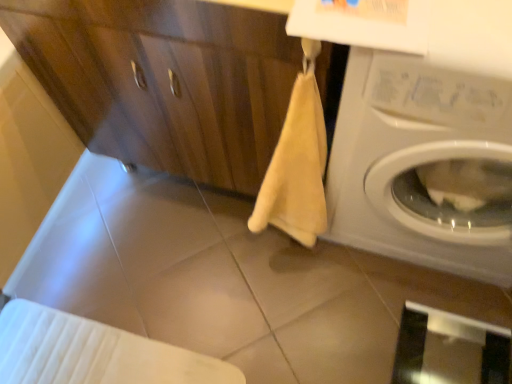
Question: Is beige matte tile at center to the left of transparent glass screen door at lower right from the viewer's perspective?

Choices:
 (A) no
 (B) yes

Answer: (B)

Question: Does beige matte tile at center come in front of transparent glass screen door at lower right?

Choices:
 (A) yes
 (B) no

Answer: (B)

Question: Can you see beige matte tile at center touching transparent glass screen door at lower right?

Choices:
 (A) no
 (B) yes

Answer: (A)

Question: From the image's perspective, would you say beige matte tile at center is positioned over transparent glass screen door at lower right?

Choices:
 (A) yes
 (B) no

Answer: (A)

Question: Can you confirm if beige matte tile at center is smaller than transparent glass screen door at lower right?

Choices:
 (A) yes
 (B) no

Answer: (B)

Question: Is beige matte tile at center further to the viewer compared to transparent glass screen door at lower right?

Choices:
 (A) no
 (B) yes

Answer: (B)

Question: Can you confirm if beige matte tile at center is taller than white glossy washing machine at right?

Choices:
 (A) no
 (B) yes

Answer: (A)

Question: Is beige matte tile at center looking in the opposite direction of white glossy washing machine at right?

Choices:
 (A) yes
 (B) no

Answer: (B)

Question: Is beige matte tile at center closer to the viewer compared to white glossy washing machine at right?

Choices:
 (A) yes
 (B) no

Answer: (B)

Question: Is beige matte tile at center aimed at white glossy washing machine at right?

Choices:
 (A) no
 (B) yes

Answer: (A)

Question: Does beige matte tile at center have a lesser height compared to white glossy washing machine at right?

Choices:
 (A) no
 (B) yes

Answer: (B)

Question: Is beige matte tile at center smaller than white glossy washing machine at right?

Choices:
 (A) yes
 (B) no

Answer: (A)

Question: Is beige matte tile at center wider than matte wood dresser at center?

Choices:
 (A) yes
 (B) no

Answer: (B)